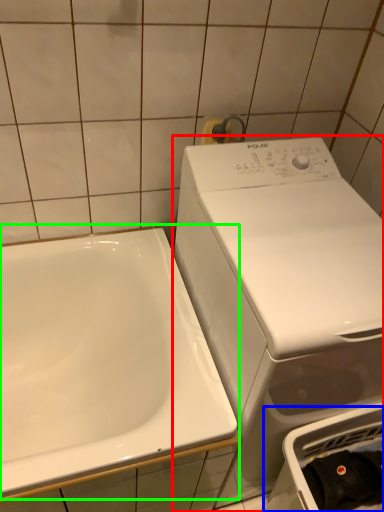
Question: Which object is positioned farthest from washing machine (highlighted by a red box)? Select from dish washer (highlighted by a blue box) and sink (highlighted by a green box).

Choices:
 (A) dish washer
 (B) sink

Answer: (B)